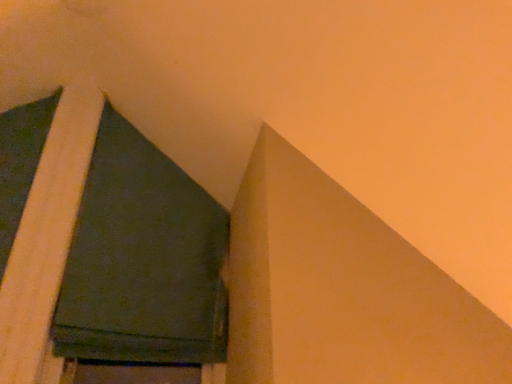
This screenshot has width=512, height=384. What do you see at coordinates (143, 259) in the screenshot?
I see `matte black screen at left` at bounding box center [143, 259].

Where is `matte black screen at left`? This screenshot has width=512, height=384. matte black screen at left is located at coordinates (x=143, y=259).

You are a GUI agent. You are given a task and a screenshot of the screen. Output one action in this format:
    pyautogui.click(x=<x>, y=<y>)
    Task: Click on the matte black screen at left
    
    Given the screenshot: What is the action you would take?
    143,259